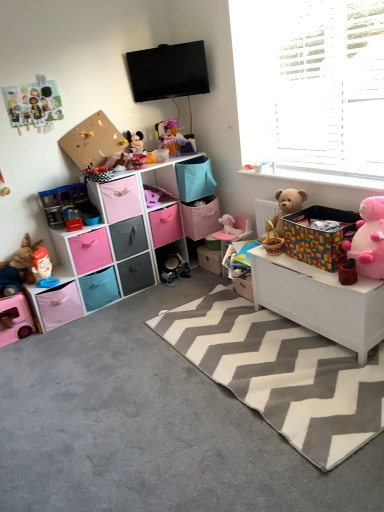
Identify the location of free space in front of pink fabric storage cubes at left. (107, 353).